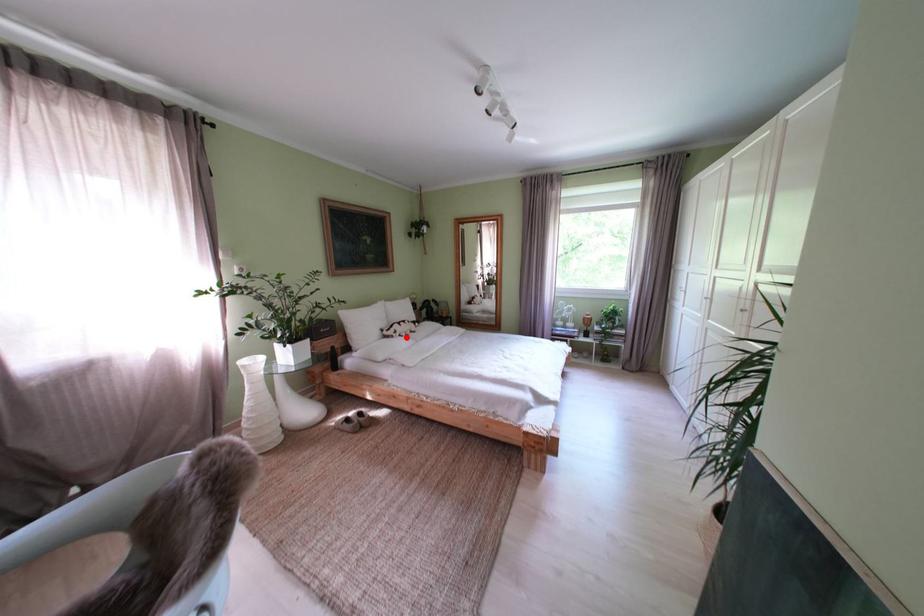
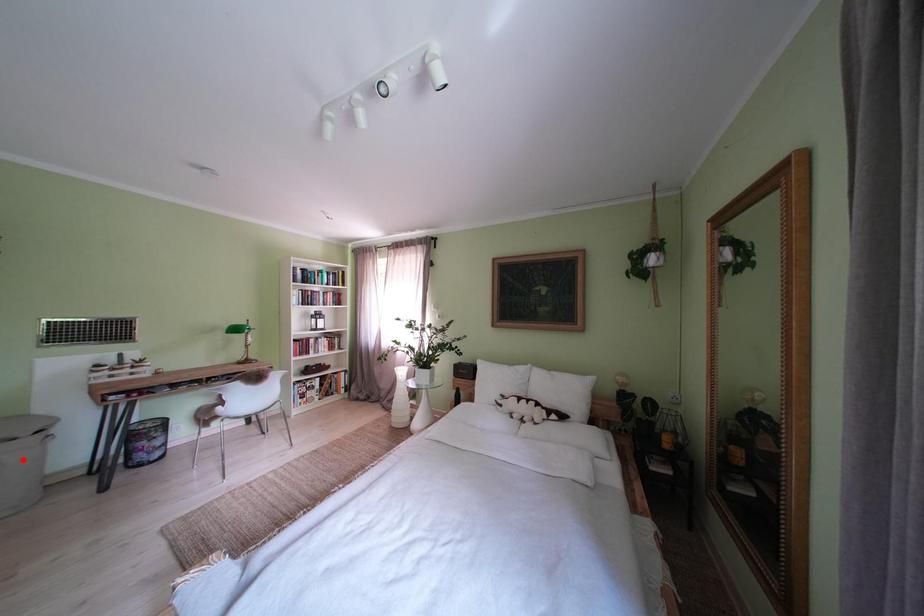
I am providing you with two images of the same scene from different viewpoints. A red point is marked on the first image and another point is marked on the second image. Do the highlighted points in image1 and image2 indicate the same real-world spot?

No